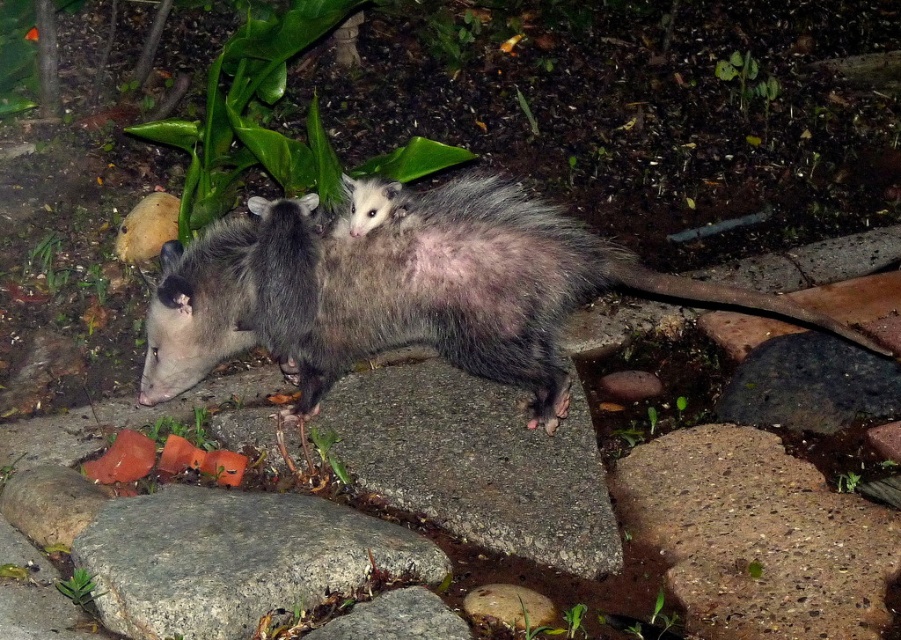
Based on the photo, you are a wildlife photographer trying to capture a photo of the fuzzy gray opossum at center and the gray smooth rock at center. Since you want to ensure both subjects are clearly visible, which one should you focus on first considering their heights?

The fuzzy gray opossum at center has a greater height compared to the gray smooth rock at center, so you should focus on the fuzzy gray opossum at center first to ensure both are in clear view.

You are standing on the stone pathway and see the fuzzy gray opossum at center and the smooth orange slices at lower left. Which object is closer to your left side?

The smooth orange slices at lower left are closer to your left side because they are positioned to the left of the fuzzy gray oposson at center.

You are standing on the stone pathway and want to pick up the gray smooth rock at center and the smooth orange slices at lower left. Which object will require you to bend down more to reach?

The gray smooth rock at center is closer to the viewer than the smooth orange slices at lower left, so you will need to bend down more to reach the smooth orange slices at lower left since they are farther away.